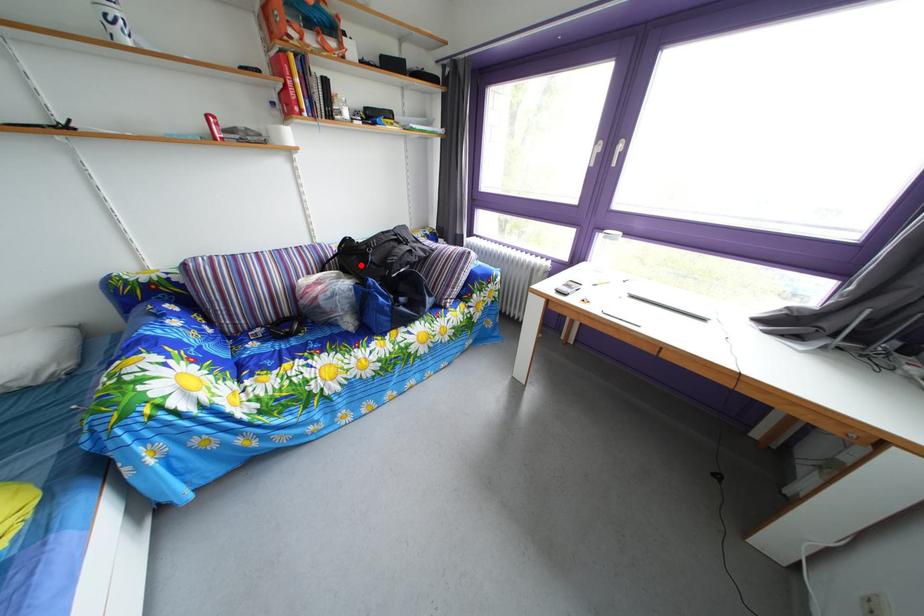
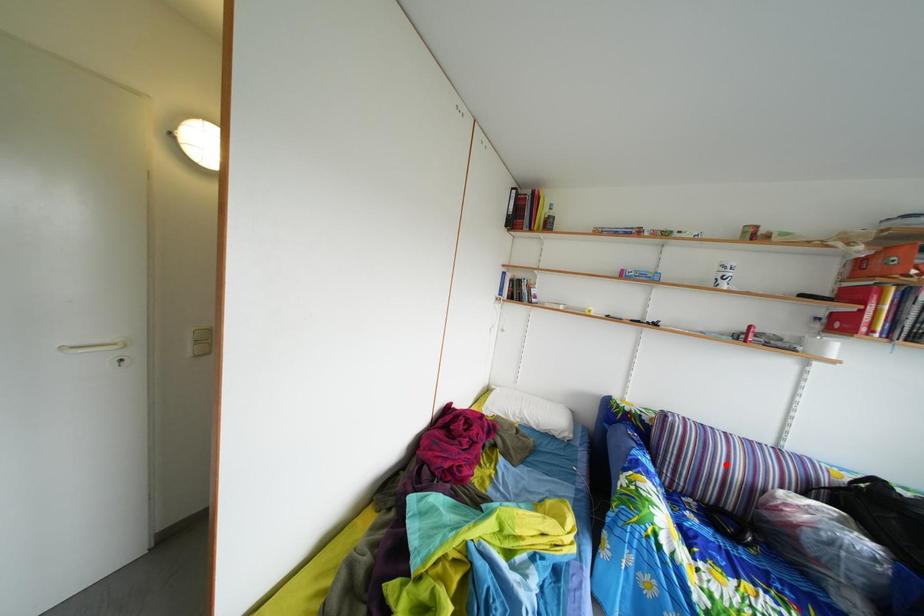
I am providing you with two images of the same scene from different viewpoints. A red point is marked on the first image and another point is marked on the second image. Does the point marked in image1 correspond to the same location as the one in image2?

No